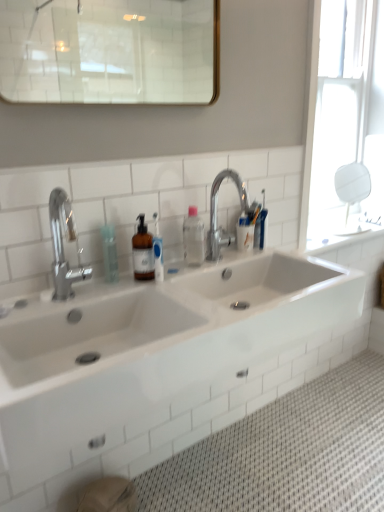
Question: Based on their sizes in the image, would you say silver metallic faucet at upper center, which ranks as the 1th tap in back-to-front order, is bigger or smaller than polished chrome faucet at left, which is the 2th tap in back-to-front order?

Choices:
 (A) big
 (B) small

Answer: (A)

Question: Visually, is silver metallic faucet at upper center, which ranks as the 1th tap in back-to-front order, positioned to the left or to the right of polished chrome faucet at left, the 1th tap when ordered from left to right?

Choices:
 (A) right
 (B) left

Answer: (A)

Question: Which object is the farthest from the transparent glass mirror at upper right?

Choices:
 (A) transparent plastic bottle at center
 (B) white glossy sink at center
 (C) transparent plastic bottle at center
 (D) polished chrome faucet at left, which appears as the 2th tap when viewed from the right
 (E) silver metallic faucet at upper center, which ranks as the 1th tap in back-to-front order

Answer: (D)

Question: Which is nearer to the white glass mirror at upper center?

Choices:
 (A) white glossy sink at center
 (B) polished chrome faucet at left, which appears as the 2th tap when viewed from the right
 (C) transparent plastic bottle at center
 (D) silver metallic faucet at upper center, which ranks as the 1th tap in back-to-front order
 (E) transparent glass mirror at upper right

Answer: (E)